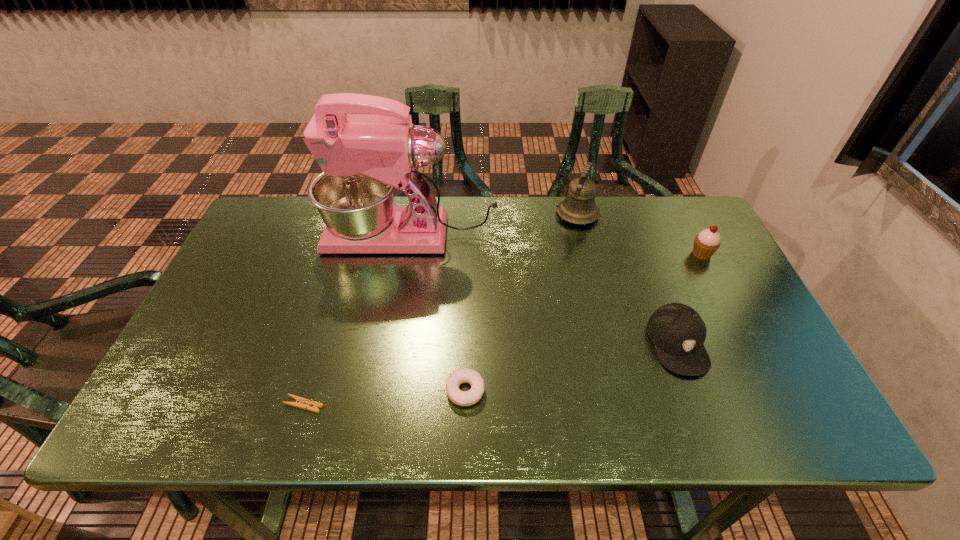
You are a GUI agent. You are given a task and a screenshot of the screen. Output one action in this format:
    pyautogui.click(x=<x>, y=<y>)
    Task: Click on the free space between the fifth tallest object and the tallest object
    The width and height of the screenshot is (960, 540).
    Given the screenshot: What is the action you would take?
    pyautogui.click(x=439, y=313)

At what (x,y) coordinates should I click in order to perform the action: click on empty location between the cap and the cupcake. Please return your answer as a coordinate pair (x, y). Looking at the image, I should click on (689, 299).

Where is `vacant area that lies between the shortest object and the third shortest object`? The image size is (960, 540). vacant area that lies between the shortest object and the third shortest object is located at coordinates click(x=491, y=374).

You are a GUI agent. You are given a task and a screenshot of the screen. Output one action in this format:
    pyautogui.click(x=<x>, y=<y>)
    Task: Click on the vacant space that's between the third tallest object and the third object from right to left
    This screenshot has height=540, width=960.
    Given the screenshot: What is the action you would take?
    pyautogui.click(x=639, y=234)

This screenshot has width=960, height=540. I want to click on vacant space that's between the fifth shortest object and the tallest object, so click(x=494, y=225).

The width and height of the screenshot is (960, 540). Identify the location of vacant region between the third tallest object and the second shortest object. (584, 322).

This screenshot has width=960, height=540. I want to click on free point between the fourth object from left to right and the shortest object, so click(441, 309).

Where is `blank region between the cap and the tallest object`? The image size is (960, 540). blank region between the cap and the tallest object is located at coordinates (544, 289).

Identify which object is the fourth nearest to the clothespin. Please provide its 2D coordinates. Your answer should be formatted as a tuple, i.e. [(x, y)], where the tuple contains the x and y coordinates of a point satisfying the conditions above.

[(579, 207)]

Image resolution: width=960 pixels, height=540 pixels. Find the location of `object that is the fourth closest to the mixer`. object that is the fourth closest to the mixer is located at coordinates (302, 403).